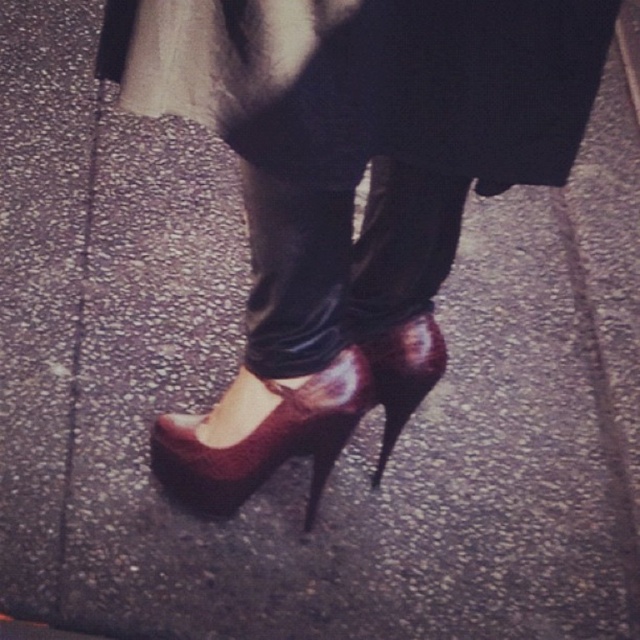
You are a fashion designer analyzing the image. You need to determine the color of the high heels based on the coordinates provided. What is the color of the shoe at point (266, 440)?

The point (266, 440) indicates a shiny burgundy leather high heeled shoe at center, so the color is burgundy.

You are a fashion designer observing the image. You need to identify the color of the high heels at the point specified in the scene. What is the color of the high heels located at point (266, 440)?

The shiny burgundy leather high heeled shoe at center is located at point (266, 440), so the color is burgundy.

You are a fashion designer observing the image. You need to determine where the point at coordinates (403, 374) is located. Based on the scene, which object does this point belong to?

The point at coordinates (403, 374) is located on the shiny burgundy high heeled shoe at center.